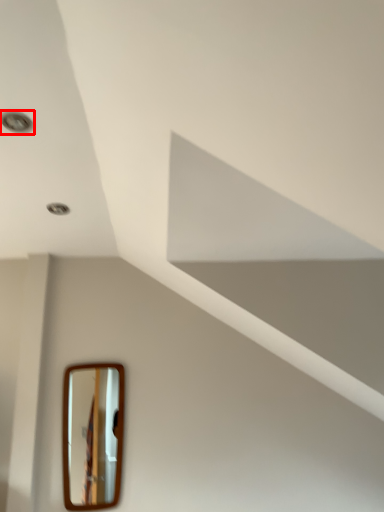
Question: Observing the image, what is the correct spatial positioning of droplight (annotated by the red box) in reference to mirror?

Choices:
 (A) right
 (B) left

Answer: (B)